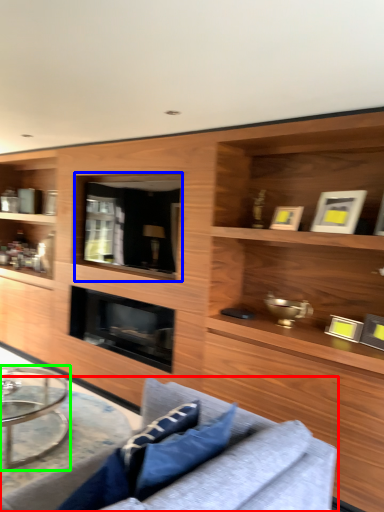
Question: Which object is the closest to the studio couch (highlighted by a red box)? Choose among these: glass door (highlighted by a blue box) or coffee table (highlighted by a green box).

Choices:
 (A) glass door
 (B) coffee table

Answer: (B)